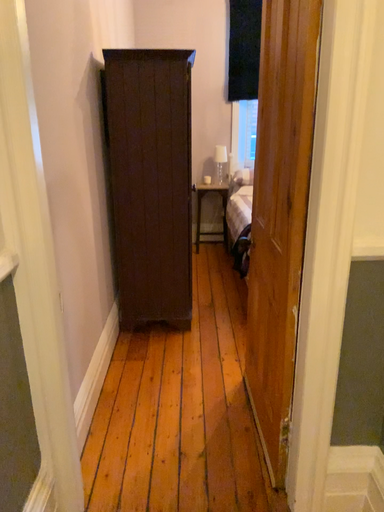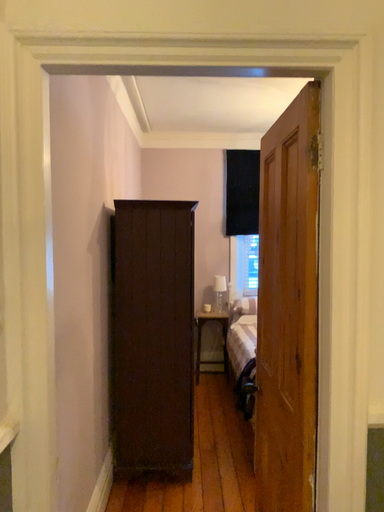
Question: How did the camera likely rotate when shooting the video?

Choices:
 (A) rotated upward
 (B) rotated downward

Answer: (A)